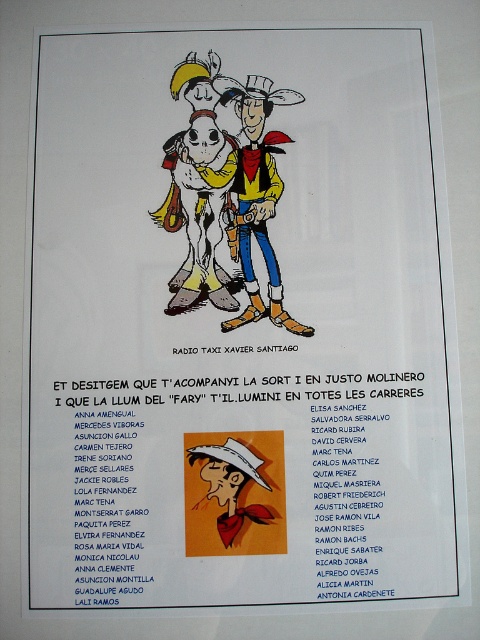
Consider the image. You are designing a poster and want to ensure the matte yellow cowboy hat at upper center and the white matte cowboy hat at center are proportionally sized. According to the image, which hat should be made bigger to maintain the correct proportions?

The matte yellow cowboy hat at upper center should be made bigger since it is larger in size than the white matte cowboy hat at center according to the description.

You are designing a promotional poster and need to ensure the matte yellow cowboy at center and the white matte cowboy hat at center are proportionally accurate. Based on the image, which object should be scaled down to maintain the correct proportions?

The white matte cowboy hat at center should be scaled down because the matte yellow cowboy at center is larger in size compared to the white matte cowboy hat at center, so reducing the hat size will maintain proper proportions.